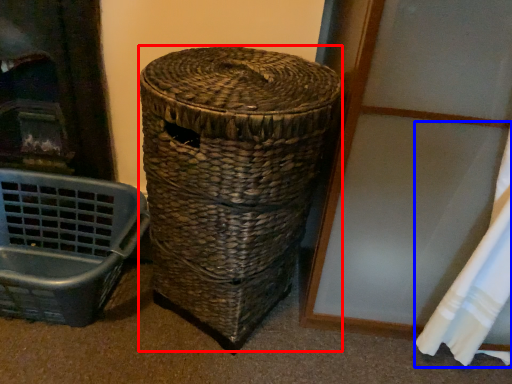
Question: Among these objects, which one is farthest to the camera, basket (highlighted by a red box) or curtain (highlighted by a blue box)?

Choices:
 (A) basket
 (B) curtain

Answer: (A)